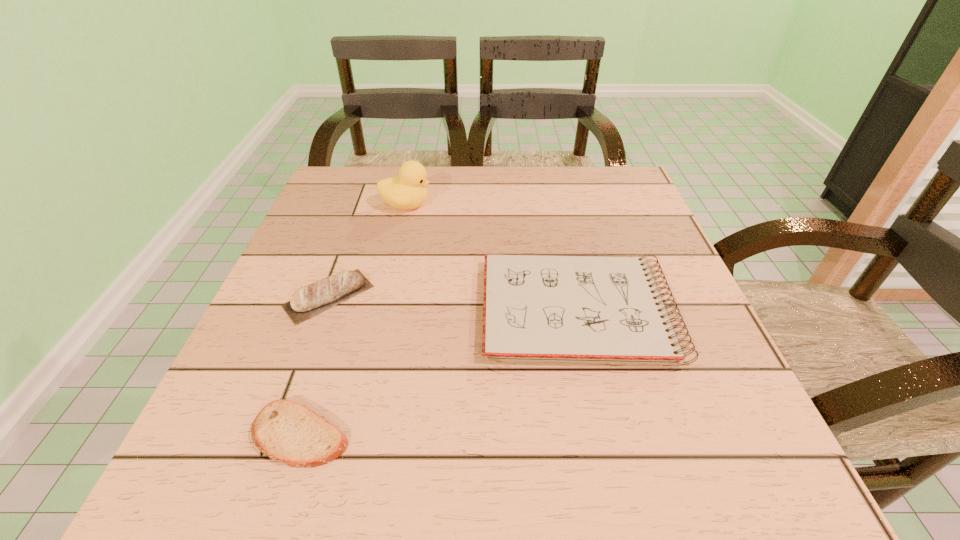
Identify the location of free spot between the taller pita bread and the rightmost object. (453, 303).

The width and height of the screenshot is (960, 540). What are the coordinates of `object that can be found as the closest to the taller pita bread` in the screenshot? It's located at (287, 432).

Select which object is the second closest to the shortest object. Please provide its 2D coordinates. Your answer should be formatted as a tuple, i.e. [(x, y)], where the tuple contains the x and y coordinates of a point satisfying the conditions above.

[(548, 308)]

Locate an element on the screen. vacant area in the image that satisfies the following two spatial constraints: 1. on the front-facing side of the tallest object; 2. on the right side of the notepad is located at coordinates (382, 310).

You are a GUI agent. You are given a task and a screenshot of the screen. Output one action in this format:
    pyautogui.click(x=<x>, y=<y>)
    Task: Click on the free space in the image that satisfies the following two spatial constraints: 1. on the front-facing side of the tallest object; 2. on the right side of the rightmost object
    Image resolution: width=960 pixels, height=540 pixels.
    Given the screenshot: What is the action you would take?
    pyautogui.click(x=382, y=310)

Where is `vacant space that satisfies the following two spatial constraints: 1. on the back side of the rightmost object; 2. on the right side of the nearest object`? The width and height of the screenshot is (960, 540). vacant space that satisfies the following two spatial constraints: 1. on the back side of the rightmost object; 2. on the right side of the nearest object is located at coordinates (340, 310).

You are a GUI agent. You are given a task and a screenshot of the screen. Output one action in this format:
    pyautogui.click(x=<x>, y=<y>)
    Task: Click on the free space that satisfies the following two spatial constraints: 1. on the front-facing side of the duck; 2. on the left side of the rightmost object
    
    Given the screenshot: What is the action you would take?
    pyautogui.click(x=382, y=310)

This screenshot has width=960, height=540. I want to click on free point that satisfies the following two spatial constraints: 1. on the back side of the rightmost object; 2. on the front-facing side of the tallest object, so click(554, 205).

The width and height of the screenshot is (960, 540). I want to click on free space that satisfies the following two spatial constraints: 1. on the front-facing side of the farthest object; 2. on the front side of the farther pita bread, so click(385, 296).